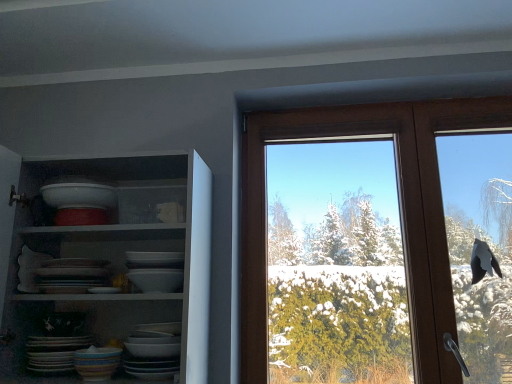
Describe the element at coordinates (97, 363) in the screenshot. This screenshot has width=512, height=384. I see `multicolored ceramic bowl at lower left` at that location.

Identify the location of white glossy shelves at upper left. The width and height of the screenshot is (512, 384). (105, 266).

I want to click on matte ceramic platter at lower left, so click(54, 353).

Is there a large distance between matte ceramic platter at lower left and white glossy shelves at upper left?

That's not correct — matte ceramic platter at lower left is a little close to white glossy shelves at upper left.

Based on their sizes in the image, would you say matte ceramic platter at lower left is bigger or smaller than white glossy shelves at upper left?

In the image, matte ceramic platter at lower left appears to be smaller than white glossy shelves at upper left.

From the image's perspective, is matte ceramic platter at lower left on white glossy shelves at upper left?

Actually, matte ceramic platter at lower left appears below white glossy shelves at upper left in the image.

Does point (57, 368) come closer to viewer compared to point (132, 227)?

Yes, point (57, 368) is closer to viewer.

Does point (92, 350) lie in front of point (248, 204)?

Yes, point (92, 350) is closer to viewer.

Between multicolored ceramic bowl at lower left and brown wooden window at upper right, which one has larger width?

With larger width is brown wooden window at upper right.

The height and width of the screenshot is (384, 512). I want to click on window located on the right of multicolored ceramic bowl at lower left, so click(x=399, y=211).

Are brown wooden window at upper right and multicolored ceramic bowl at lower left making contact?

There is a gap between brown wooden window at upper right and multicolored ceramic bowl at lower left.

At what (x,y) coordinates should I click in order to perform the action: click on tableware below the brown wooden window at upper right (from a real-world perspective). Please return your answer as a coordinate pair (x, y). This screenshot has height=384, width=512. Looking at the image, I should click on (97, 363).

What's the angular difference between brown wooden window at upper right and multicolored ceramic bowl at lower left's facing directions?

The angular difference between brown wooden window at upper right and multicolored ceramic bowl at lower left is 0.835 degrees.

From the picture: Visually, is brown wooden window at upper right positioned to the left or to the right of multicolored ceramic bowl at lower left?

Based on their positions, brown wooden window at upper right is located to the right of multicolored ceramic bowl at lower left.

Between white glossy shelves at upper left and matte ceramic platter at lower left, which one is positioned in front?

white glossy shelves at upper left.

Is white glossy shelves at upper left positioned far away from matte ceramic platter at lower left?

No.

Can you confirm if white glossy shelves at upper left is wider than matte ceramic platter at lower left?

Yes, white glossy shelves at upper left is wider than matte ceramic platter at lower left.

Between brown wooden window at upper right and white glossy shelves at upper left, which one has larger size?

white glossy shelves at upper left is bigger.

Is brown wooden window at upper right turned away from white glossy shelves at upper left?

No, brown wooden window at upper right is not facing away from white glossy shelves at upper left.

I want to click on window that appears above the white glossy shelves at upper left (from a real-world perspective), so click(399, 211).

Does brown wooden window at upper right lie in front of white glossy shelves at upper left?

No, the depth of brown wooden window at upper right is greater than that of white glossy shelves at upper left.

Based on the photo, is brown wooden window at upper right far from matte ceramic platter at lower left?

Yes, brown wooden window at upper right is far from matte ceramic platter at lower left.

Which object is wider, brown wooden window at upper right or matte ceramic platter at lower left?

With larger width is matte ceramic platter at lower left.

Can you confirm if brown wooden window at upper right is positioned to the right of matte ceramic platter at lower left?

Indeed, brown wooden window at upper right is positioned on the right side of matte ceramic platter at lower left.

From the image's perspective, who appears lower, brown wooden window at upper right or matte ceramic platter at lower left?

matte ceramic platter at lower left.

From the image's perspective, is white glossy shelves at upper left positioned above or below multicolored ceramic bowl at lower left?

white glossy shelves at upper left is above multicolored ceramic bowl at lower left.

At what (x,y) coordinates should I click in order to perform the action: click on shelf on the left of multicolored ceramic bowl at lower left. Please return your answer as a coordinate pair (x, y). This screenshot has height=384, width=512. Looking at the image, I should click on (105, 266).

Measure the distance between white glossy shelves at upper left and multicolored ceramic bowl at lower left.

A distance of 12.69 inches exists between white glossy shelves at upper left and multicolored ceramic bowl at lower left.

Is white glossy shelves at upper left taller or shorter than multicolored ceramic bowl at lower left?

Considering their sizes, white glossy shelves at upper left has more height than multicolored ceramic bowl at lower left.

Identify the location of platter behind the white glossy shelves at upper left. (54, 353).

You are a GUI agent. You are given a task and a screenshot of the screen. Output one action in this format:
    pyautogui.click(x=<x>, y=<y>)
    Task: Click on the tableware on the left of the brown wooden window at upper right
    
    Given the screenshot: What is the action you would take?
    pyautogui.click(x=97, y=363)

From the image, which object appears to be nearer to white glossy shelves at upper left, brown wooden window at upper right or matte ceramic platter at lower left?

Based on the image, matte ceramic platter at lower left appears to be nearer to white glossy shelves at upper left.

When comparing their distances from brown wooden window at upper right, does white glossy shelves at upper left or multicolored ceramic bowl at lower left seem closer?

white glossy shelves at upper left lies closer to brown wooden window at upper right than the other object.

Looking at this image, based on their spatial positions, is multicolored ceramic bowl at lower left or white glossy shelves at upper left closer to brown wooden window at upper right?

white glossy shelves at upper left is positioned closer to the anchor brown wooden window at upper right.

Looking at the image, which one is located closer to matte ceramic platter at lower left, multicolored ceramic bowl at lower left or brown wooden window at upper right?

The object closer to matte ceramic platter at lower left is multicolored ceramic bowl at lower left.

When comparing their distances from brown wooden window at upper right, does matte ceramic platter at lower left or white glossy shelves at upper left seem further?

Among the two, matte ceramic platter at lower left is located further to brown wooden window at upper right.

When comparing their distances from multicolored ceramic bowl at lower left, does brown wooden window at upper right or white glossy shelves at upper left seem closer?

white glossy shelves at upper left lies closer to multicolored ceramic bowl at lower left than the other object.

From the image, which object appears to be farther from white glossy shelves at upper left, multicolored ceramic bowl at lower left or matte ceramic platter at lower left?

multicolored ceramic bowl at lower left is positioned further to the anchor white glossy shelves at upper left.

Estimate the real-world distances between objects in this image. Which object is closer to matte ceramic platter at lower left, multicolored ceramic bowl at lower left or white glossy shelves at upper left?

Among the two, multicolored ceramic bowl at lower left is located nearer to matte ceramic platter at lower left.

Find the location of a particular element. This screenshot has height=384, width=512. tableware situated between matte ceramic platter at lower left and brown wooden window at upper right from left to right is located at coordinates (97, 363).

This screenshot has height=384, width=512. Find the location of `tableware situated between white glossy shelves at upper left and brown wooden window at upper right from left to right`. tableware situated between white glossy shelves at upper left and brown wooden window at upper right from left to right is located at coordinates (97, 363).

You are a GUI agent. You are given a task and a screenshot of the screen. Output one action in this format:
    pyautogui.click(x=<x>, y=<y>)
    Task: Click on the tableware between white glossy shelves at upper left and matte ceramic platter at lower left along the z-axis
    The image size is (512, 384).
    Given the screenshot: What is the action you would take?
    pyautogui.click(x=97, y=363)

Identify the location of shelf between matte ceramic platter at lower left and brown wooden window at upper right from left to right. click(105, 266).